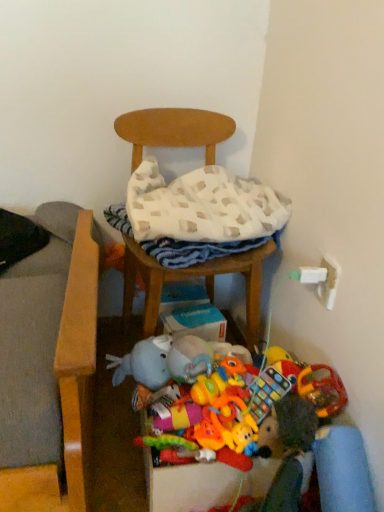
Question: Would you say rubberized plastic toy at lower center, the 2th toy in the left-to-right sequence, contains wooden chair at center?

Choices:
 (A) yes
 (B) no

Answer: (B)

Question: Considering the relative positions of rubberized plastic toy at lower center, which ranks as the 1th toy in right-to-left order, and wooden chair at center in the image provided, is rubberized plastic toy at lower center, which ranks as the 1th toy in right-to-left order, behind wooden chair at center?

Choices:
 (A) yes
 (B) no

Answer: (B)

Question: Does rubberized plastic toy at lower center, the 2th toy in the left-to-right sequence, have a lesser width compared to wooden chair at center?

Choices:
 (A) no
 (B) yes

Answer: (B)

Question: From the image's perspective, is rubberized plastic toy at lower center, which ranks as the 1th toy in right-to-left order, located above wooden chair at center?

Choices:
 (A) yes
 (B) no

Answer: (B)

Question: From a real-world perspective, is rubberized plastic toy at lower center, the 2th toy in the left-to-right sequence, on wooden chair at center?

Choices:
 (A) yes
 (B) no

Answer: (B)

Question: Is rubberized plastic toy at lower center, which ranks as the 1th toy in right-to-left order, at the left side of wooden chair at center?

Choices:
 (A) yes
 (B) no

Answer: (B)

Question: Is wooden chair at center positioned beyond the bounds of rubberized plastic toy at lower center, the 2th toy in the left-to-right sequence?

Choices:
 (A) no
 (B) yes

Answer: (B)

Question: From the image's perspective, would you say wooden chair at center is positioned over rubberized plastic toy at lower center, the 2th toy in the left-to-right sequence?

Choices:
 (A) no
 (B) yes

Answer: (B)

Question: Is the position of wooden chair at center more distant than that of rubberized plastic toy at lower center, the 2th toy in the left-to-right sequence?

Choices:
 (A) no
 (B) yes

Answer: (B)

Question: Is wooden chair at center smaller than rubberized plastic toy at lower center, which ranks as the 1th toy in right-to-left order?

Choices:
 (A) no
 (B) yes

Answer: (A)

Question: Is wooden chair at center surrounding rubberized plastic toy at lower center, which ranks as the 1th toy in right-to-left order?

Choices:
 (A) no
 (B) yes

Answer: (A)

Question: Is wooden chair at center with rubberized plastic toy at lower center, which ranks as the 1th toy in right-to-left order?

Choices:
 (A) yes
 (B) no

Answer: (B)

Question: From a real-world perspective, does wooden chair at center sit lower than white woven blanket at center?

Choices:
 (A) yes
 (B) no

Answer: (A)